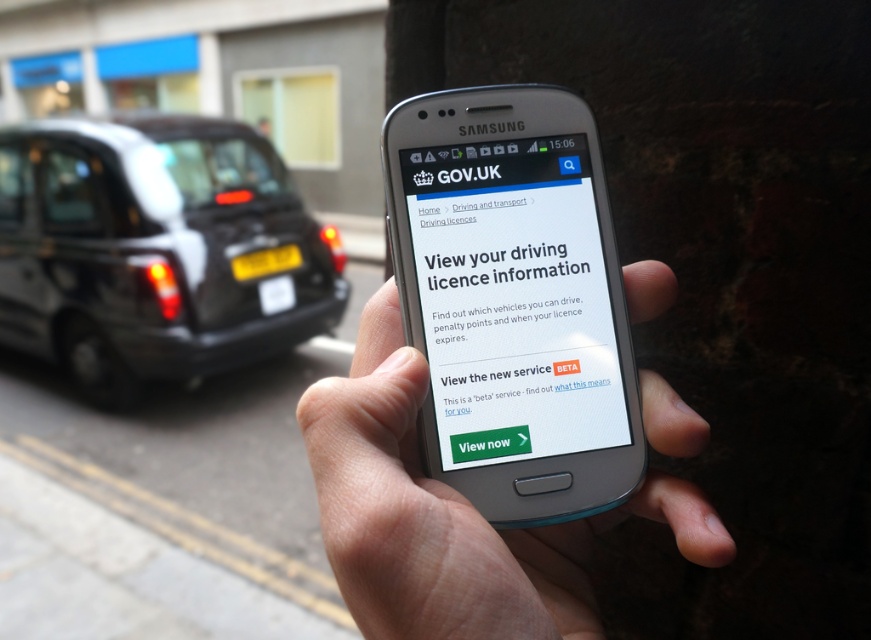
You are a smartphone designer analyzing the image. The smooth skin hand at center and the white glossy screen at center are both in the frame. Which object occupies more vertical space in the image?

The smooth skin hand at center occupies more vertical space in the image because it has a greater height compared to the white glossy screen at center.

You are a delivery driver holding a Samsung smartphone and standing in front of a black metallic taxi at left. You need to check your driving license information on the phone. Can you check the information without moving your phone?

The black metallic taxi at left and viewer are 8.52 feet apart from each other, so yes, you can check the driving license information on the Samsung smartphone without moving it since the distance is sufficient for viewing.

You are a driver who wants to check the driving license information on your phone. You notice a black metallic taxi at left and a smooth skin hand at center in the image. Which object is taller?

The black metallic taxi at left is much taller than the smooth skin hand at center.